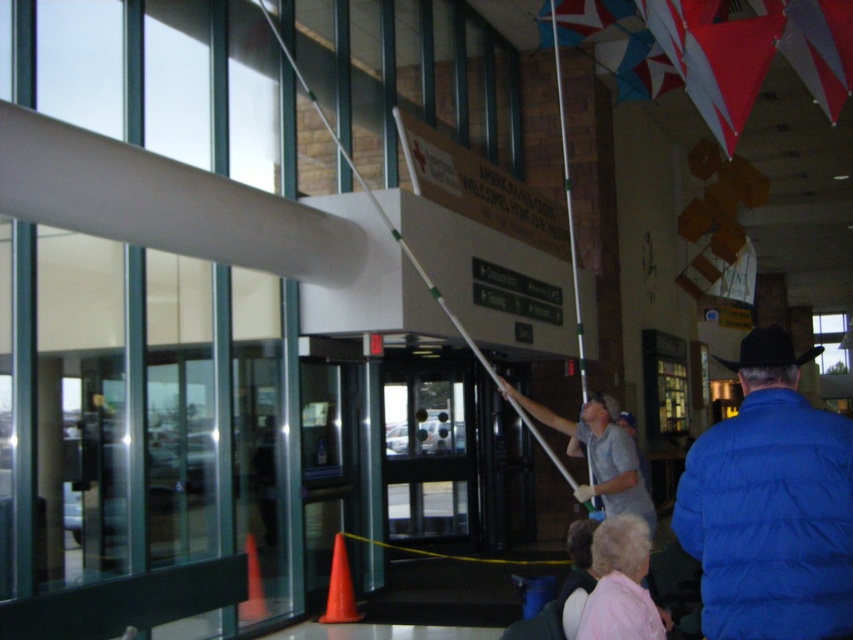
You are standing in the entrance area and see the gray fabric pole at center and the yellow string at center. Which object is located to the right side?

The gray fabric pole at center is located to the right of the yellow string at center.

You are a maintenance worker in the airport and you need to place a pink fabric at lower right and an orange matte cone at lower left. Which object has a smaller width when viewed from above?

The pink fabric at lower right is thinner than the orange matte cone at lower left, so the pink fabric at lower right has a smaller width when viewed from above.

You are standing at the entrance of the building and see two points marked on the glass doors. The first point is at coordinate point (601, 609) and the second is at point (337, 614). Which point is closer to you, the observer?

Point (601, 609) is in front of point (337, 614), so the first point is closer to you.